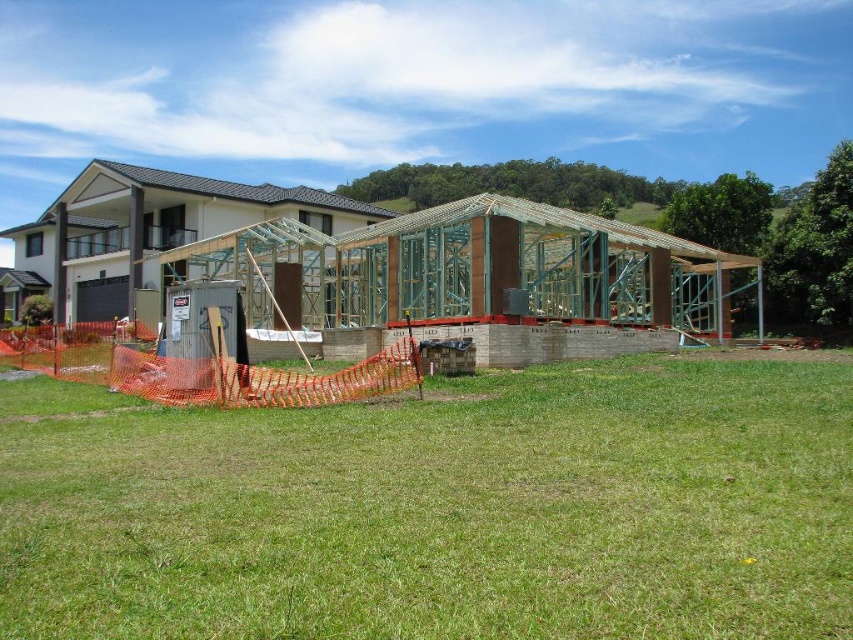
Question: Which object is farther from the camera taking this photo?

Choices:
 (A) green grass at center
 (B) wooden frame house under construction at center

Answer: (B)

Question: Which object appears closest to the camera in this image?

Choices:
 (A) green grass at center
 (B) wooden frame house under construction at center

Answer: (A)

Question: Observing the image, what is the correct spatial positioning of green grass at center in reference to wooden frame house under construction at center?

Choices:
 (A) left
 (B) right

Answer: (B)

Question: Is green grass at center below wooden frame house under construction at center?

Choices:
 (A) no
 (B) yes

Answer: (B)

Question: Can you confirm if green grass at center is positioned below wooden frame house under construction at center?

Choices:
 (A) no
 (B) yes

Answer: (B)